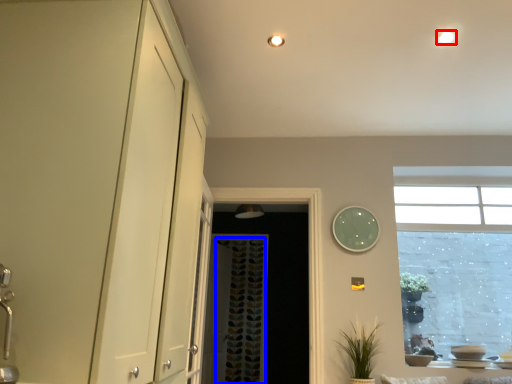
Question: Among these objects, which one is farthest to the camera, lighting (highlighted by a red box) or curtain (highlighted by a blue box)?

Choices:
 (A) lighting
 (B) curtain

Answer: (B)